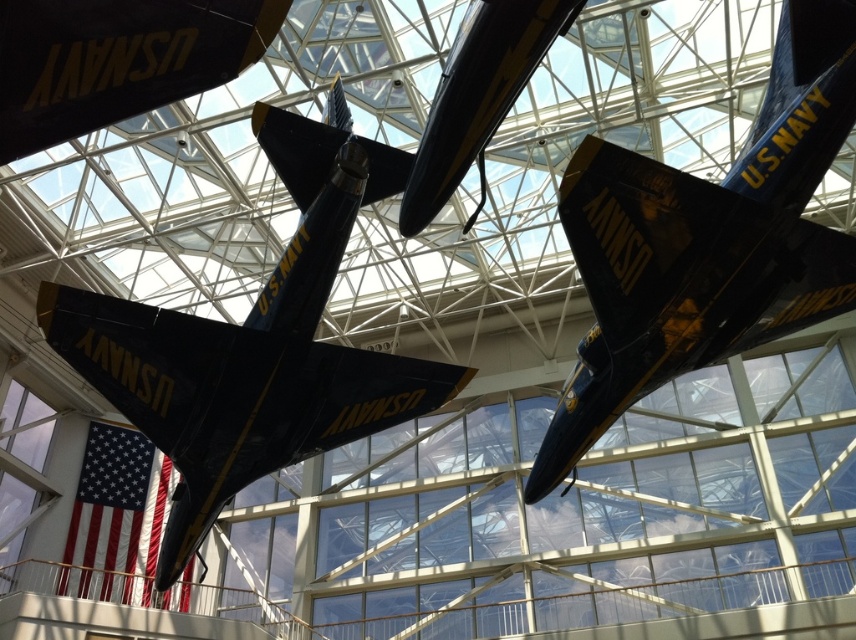
Between point (789, 285) and point (314, 221), which one is positioned in front?

Positioned in front is point (314, 221).

Is point (621, 252) positioned before point (375, 381)?

Yes, it is.

Locate an element on the screen. Image resolution: width=856 pixels, height=640 pixels. glossy black airplane at upper center is located at coordinates (706, 241).